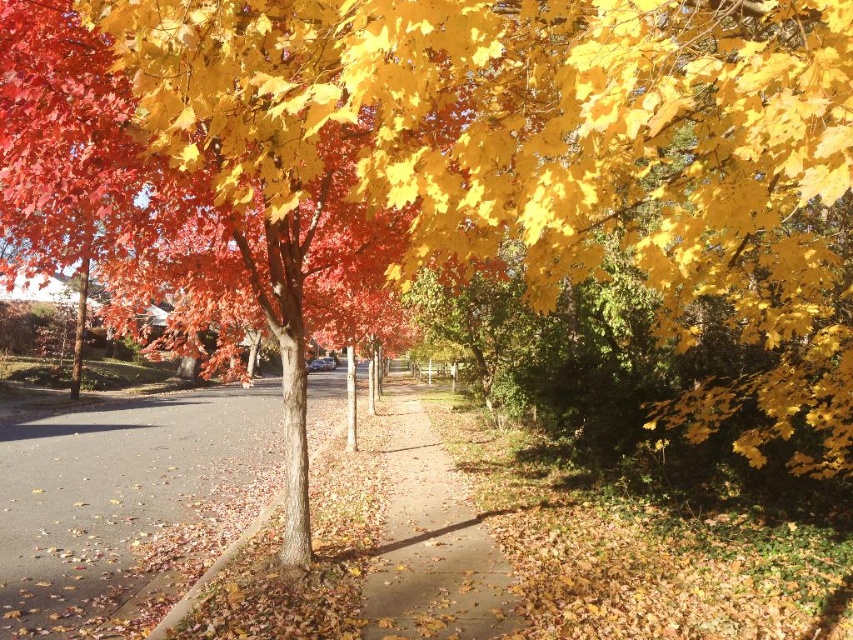
You are a gardener planning to plant flowers along the brown asphalt at lower left and the brown dirt path at center. Based on the scene, which location is positioned lower in elevation?

The brown asphalt at lower left is positioned below the brown dirt path at center, so it is lower in elevation.